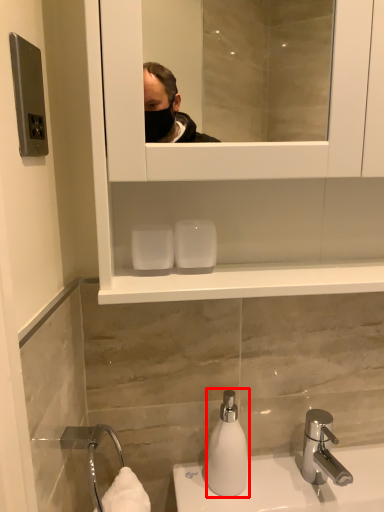
Question: From the image's perspective, where is soap dispenser (annotated by the red box) located in relation to tap in the image?

Choices:
 (A) above
 (B) below

Answer: (A)